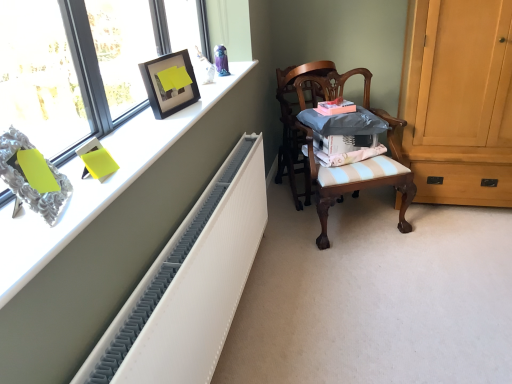
Question: In terms of size, does light brown wood cabinet at right appear bigger or smaller than white textured radiator at upper left?

Choices:
 (A) small
 (B) big

Answer: (B)

Question: Is light brown wood cabinet at right to the left or to the right of white textured radiator at upper left in the image?

Choices:
 (A) right
 (B) left

Answer: (A)

Question: Which is nearer to the wooden chair at center, the 1th chair from the back?

Choices:
 (A) matte black picture frame at upper left
 (B) matte glass window at upper left
 (C) wooden chair at center, placed as the 2th chair when sorted from back to front
 (D) white textured radiator at left
 (E) white textured radiator at upper left

Answer: (C)

Question: Which of these objects is positioned farthest from the matte glass window at upper left?

Choices:
 (A) wooden chair at center, marked as the second chair in a front-to-back arrangement
 (B) wooden chair at center, placed as the 2th chair when sorted from back to front
 (C) light brown wood cabinet at right
 (D) white textured radiator at left
 (E) white textured radiator at upper left

Answer: (C)